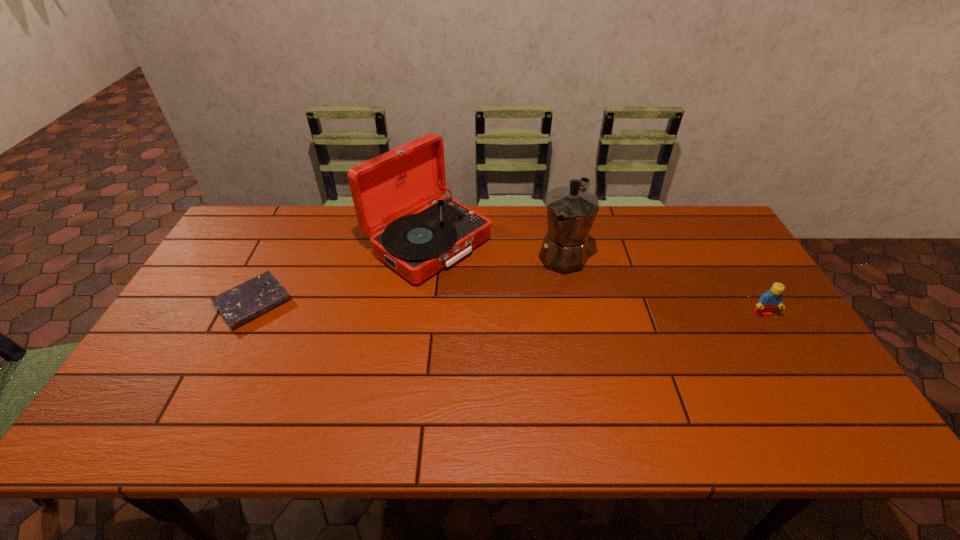
I want to click on free space on the desktop that is between the shortest object and the third tallest object and is positioned on the pouring side of the second object from right to left, so click(530, 309).

Locate an element on the screen. This screenshot has height=540, width=960. vacant space on the desktop that is between the diary and the second shortest object and is positioned on the front-facing side of the third object from right to left is located at coordinates (525, 308).